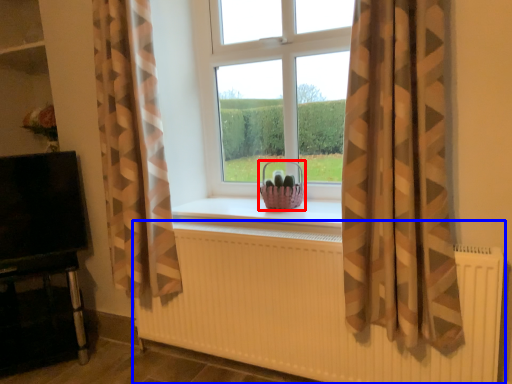
Question: Which object appears closest to the camera in this image, basket (highlighted by a red box) or radiator (highlighted by a blue box)?

Choices:
 (A) basket
 (B) radiator

Answer: (B)